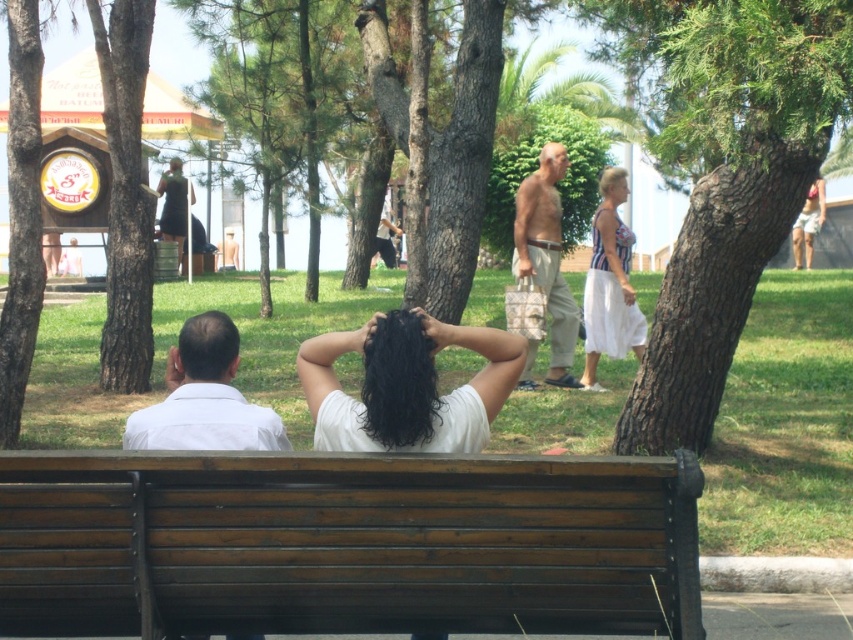
Where is `brown wood tree at center`? The width and height of the screenshot is (853, 640). brown wood tree at center is located at coordinates (722, 266).

How much distance is there between brown wood tree at center and white matte shirt at left?

The distance of brown wood tree at center from white matte shirt at left is 24.37 feet.

Does point (740, 186) come behind point (210, 403)?

Yes, point (740, 186) is farther from viewer.

Where is `brown wood tree at center`? This screenshot has height=640, width=853. brown wood tree at center is located at coordinates (722, 266).

Who is positioned more to the left, brown rough bark tree at right or white matte shirt at left?

Positioned to the left is white matte shirt at left.

What do you see at coordinates (726, 179) in the screenshot?
I see `brown rough bark tree at right` at bounding box center [726, 179].

Where is `brown rough bark tree at right`? brown rough bark tree at right is located at coordinates (726, 179).

Is brown wooden bench at center shorter than white cotton dress at center?

Indeed, brown wooden bench at center has a lesser height compared to white cotton dress at center.

Is point (584, 621) positioned in front of point (589, 314)?

Yes, point (584, 621) is closer to viewer.

The width and height of the screenshot is (853, 640). What do you see at coordinates (346, 545) in the screenshot?
I see `brown wooden bench at center` at bounding box center [346, 545].

Where is `brown wooden bench at center`? The image size is (853, 640). brown wooden bench at center is located at coordinates pyautogui.click(x=346, y=545).